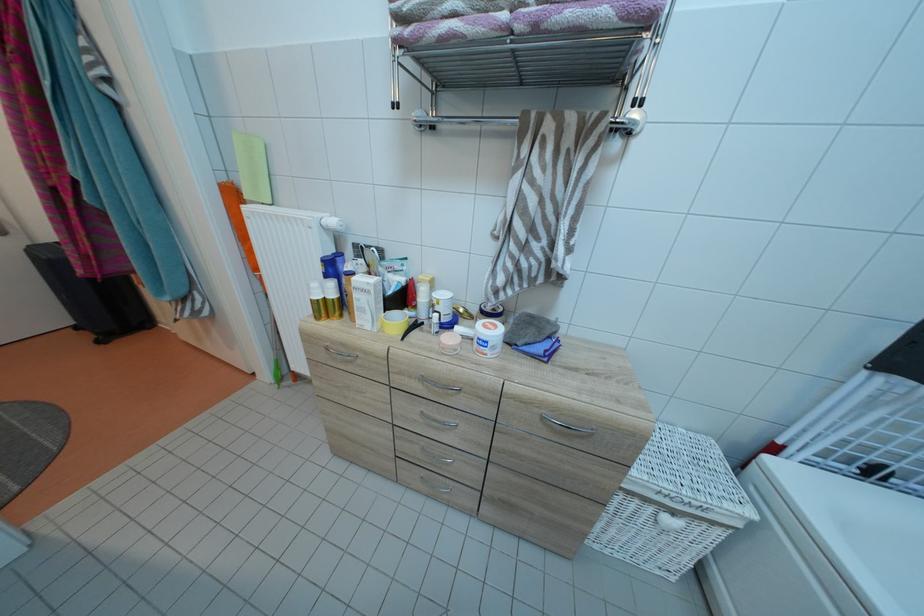
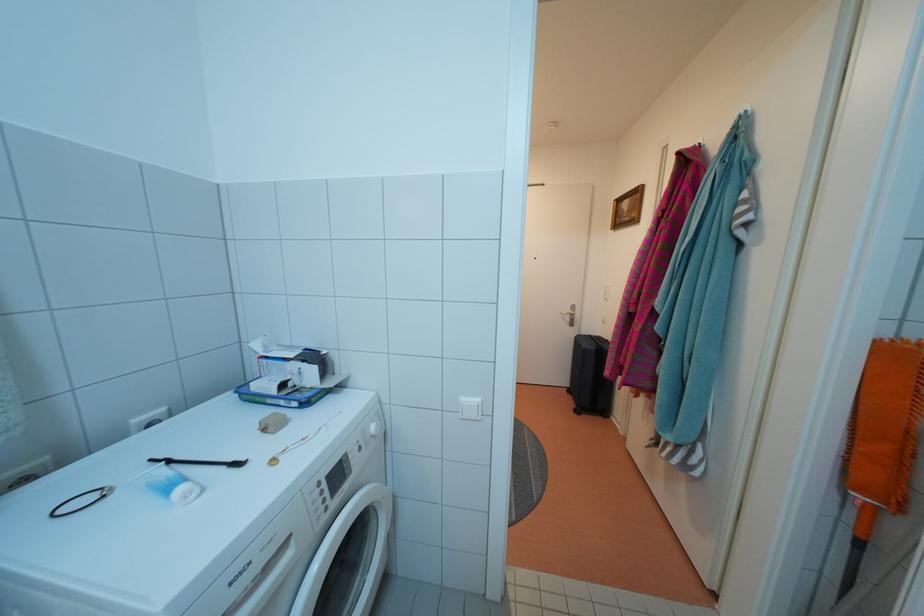
The point at (84, 333) is marked in the first image. Where is the corresponding point in the second image?

(576, 397)